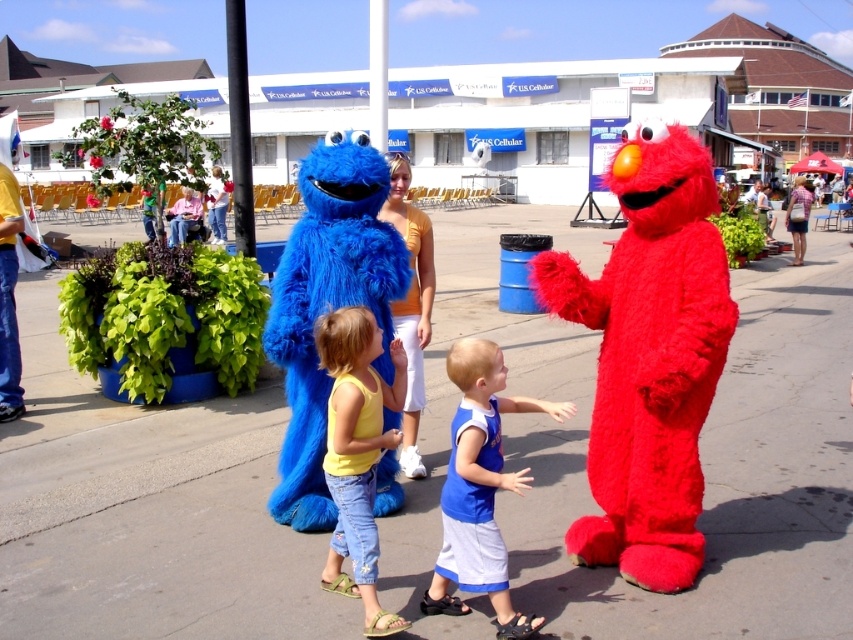
Is point (804, 192) less distant than point (216, 232)?

That is True.

Can you confirm if denim shorts at lower right is thinner than denim jeans at center?

In fact, denim shorts at lower right might be wider than denim jeans at center.

Is point (799, 225) positioned after point (227, 189)?

Yes.

Find the location of a particular element. The image size is (853, 640). denim shorts at lower right is located at coordinates (798, 218).

Based on the photo, does pink fabric shirt at center appear on the left side of denim shorts at center?

Correct, you'll find pink fabric shirt at center to the left of denim shorts at center.

Based on the photo, which is more to the left, pink fabric shirt at center or denim shorts at center?

pink fabric shirt at center

Measure the distance between pink fabric shirt at center and camera.

The distance of pink fabric shirt at center from camera is 18.52 meters.

At what (x,y) coordinates should I click in order to perform the action: click on pink fabric shirt at center. Please return your answer as a coordinate pair (x, y). This screenshot has width=853, height=640. Looking at the image, I should click on pos(183,216).

Is gray concrete pavement at center smaller than fuzzy red elmo at right?

No, gray concrete pavement at center is not smaller than fuzzy red elmo at right.

Does gray concrete pavement at center appear over fuzzy red elmo at right?

Yes, gray concrete pavement at center is above fuzzy red elmo at right.

Between point (769, 417) and point (662, 513), which one is positioned behind?

The point (769, 417) is behind.

Where is `gray concrete pavement at center`? The image size is (853, 640). gray concrete pavement at center is located at coordinates (699, 451).